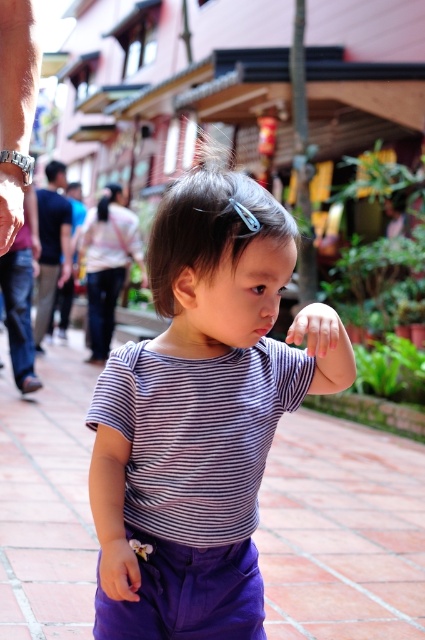
Does point (166, 486) lie behind point (39, 291)?

No, it is not.

Does striped fabric toddler at center have a lesser width compared to black cotton shirt at left?

No.

Find the location of a particular element. This screenshot has width=425, height=640. striped fabric toddler at center is located at coordinates (201, 413).

Who is more forward, (30, 264) or (50, 173)?

Point (30, 264) is more forward.

Between denim jeans at left and black cotton shirt at left, which one has less height?

Standing shorter between the two is denim jeans at left.

Between point (20, 378) and point (40, 323), which one is positioned behind?

The point (40, 323) is more distant.

Find the location of `denim jeans at left`. denim jeans at left is located at coordinates (22, 294).

Can you confirm if striped fabric toddler at center is positioned to the left of denim jeans at left?

Incorrect, striped fabric toddler at center is not on the left side of denim jeans at left.

Locate an element on the screen. striped fabric toddler at center is located at coordinates (201, 413).